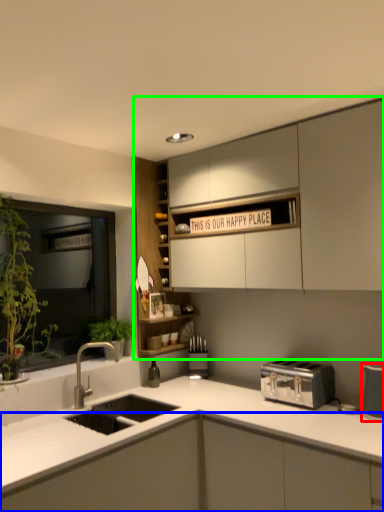
Question: Estimate the real-world distances between objects in this image. Which object is farther from appliance (highlighted by a red box), cabinetry (highlighted by a blue box) or cabinetry (highlighted by a green box)?

Choices:
 (A) cabinetry
 (B) cabinetry

Answer: (B)